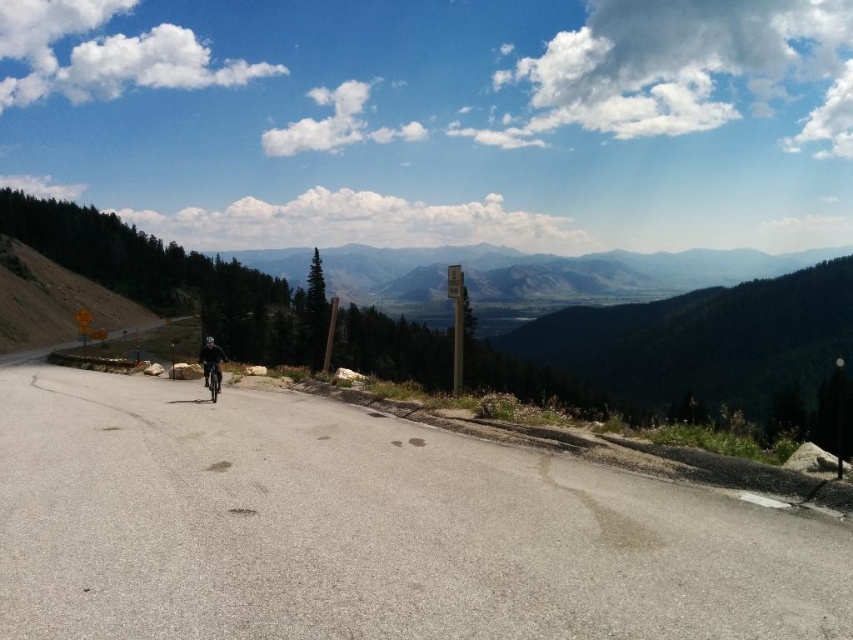
Does gray asphalt road at center have a lesser height compared to dark gray helmet at center?

Indeed, gray asphalt road at center has a lesser height compared to dark gray helmet at center.

Can you confirm if gray asphalt road at center is wider than dark gray helmet at center?

No.

Between point (268, 576) and point (218, 378), which one is positioned behind?

Point (218, 378)

Image resolution: width=853 pixels, height=640 pixels. I want to click on gray asphalt road at center, so click(367, 529).

Describe the element at coordinates (212, 360) in the screenshot. I see `dark gray helmet at center` at that location.

Is dark gray helmet at center smaller than shiny silver motorbike at center?

Incorrect, dark gray helmet at center is not smaller in size than shiny silver motorbike at center.

Which is in front, point (213, 364) or point (204, 374)?

Point (213, 364)

Find the location of a particular element. Image resolution: width=853 pixels, height=640 pixels. dark gray helmet at center is located at coordinates (212, 360).

Does gray asphalt road at center have a larger size compared to shiny silver motorbike at center?

A: Yes, gray asphalt road at center is bigger than shiny silver motorbike at center.

Which is above, gray asphalt road at center or shiny silver motorbike at center?

Positioned higher is shiny silver motorbike at center.

This screenshot has height=640, width=853. What do you see at coordinates (367, 529) in the screenshot?
I see `gray asphalt road at center` at bounding box center [367, 529].

Identify the location of gray asphalt road at center. (367, 529).